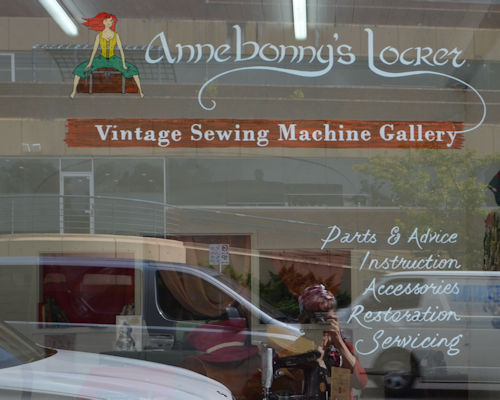
Locate an element on the screen. The height and width of the screenshot is (400, 500). reflection of white door frame on glass is located at coordinates (75, 190).